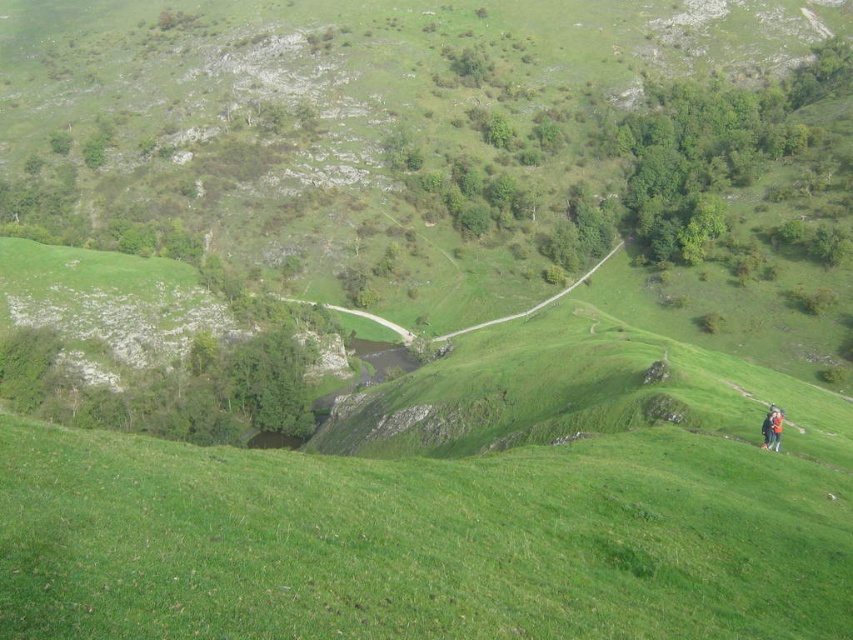
You are a hiker who has just reached the orange fabric jacket at lower right. Looking ahead, can you see the green grassy hillside at lower center in your current line of sight?

Yes, the green grassy hillside at lower center is in front of the orange fabric jacket at lower right, so it would be visible in your line of sight when standing there.

You are standing at the starting point of the hiking trail and looking towards the distant hills. You notice two points marked on your map. One is at coordinate point (775, 525) and the other at point (770, 438). Which point is closer to your current position?

Point (775, 525) is closer to your current position because it is closer to the camera than point (770, 438), indicating it is nearer to the starting point of the hiking trail.

You are standing at the starting point of the hiking trail and want to reach the green grassy hillside at lower center. Based on the 2D coordinates provided, in which direction should you head from your current position?

The green grassy hillside at lower center is located at coordinates point (418, 541), so you should head towards the lower center direction from your current position.